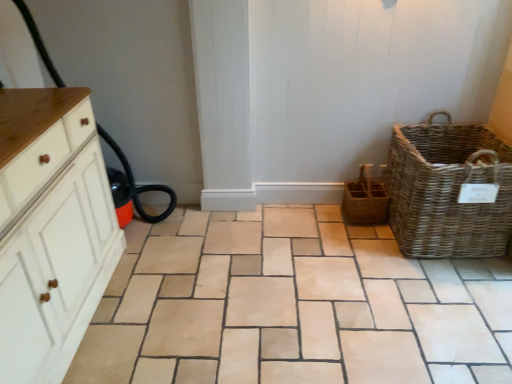
Describe the element at coordinates (51, 230) in the screenshot. The height and width of the screenshot is (384, 512). I see `white wood cabinet at left` at that location.

The image size is (512, 384). Find the location of `brown woven basket at center-right`. brown woven basket at center-right is located at coordinates (365, 199).

Where is `white wood cabinet at left`? This screenshot has height=384, width=512. white wood cabinet at left is located at coordinates (51, 230).

Considering the sizes of objects brown woven basket at center-right and natural woven picnic basket at right in the image provided, who is thinner, brown woven basket at center-right or natural woven picnic basket at right?

brown woven basket at center-right.

Identify the location of basket on the left of natural woven picnic basket at right. The height and width of the screenshot is (384, 512). (365, 199).

From a real-world perspective, who is located lower, brown woven basket at center-right or natural woven picnic basket at right?

In real-world perspective, brown woven basket at center-right is lower.

Is natural stone tile at center inside or outside of natural woven picnic basket at right?

natural stone tile at center cannot be found inside natural woven picnic basket at right.

Which object is positioned more to the left, natural stone tile at center or natural woven picnic basket at right?

natural stone tile at center.

How far apart are natural stone tile at center and natural woven picnic basket at right?

They are 23.86 inches apart.

From a real-world perspective, is natural stone tile at center above or below natural woven picnic basket at right?

Clearly, from a real-world perspective, natural stone tile at center is below natural woven picnic basket at right.

Can you tell me how much natural woven picnic basket at right and brown woven basket at center-right differ in facing direction?

There is a 0.357-degree angle between the facing directions of natural woven picnic basket at right and brown woven basket at center-right.

Is natural woven picnic basket at right not close to brown woven basket at center-right?

natural woven picnic basket at right is near brown woven basket at center-right, not far away.

Where is `picnic basket above the brown woven basket at center-right (from the image's perspective)`? picnic basket above the brown woven basket at center-right (from the image's perspective) is located at coordinates (448, 190).

The image size is (512, 384). Identify the location of picnic basket on the right of white wood cabinet at left. (448, 190).

Is natural woven picnic basket at right next to white wood cabinet at left?

No, natural woven picnic basket at right is not with white wood cabinet at left.

How different are the orientations of natural woven picnic basket at right and white wood cabinet at left in degrees?

natural woven picnic basket at right and white wood cabinet at left are facing 86.3 degrees away from each other.

From a real-world perspective, which is physically above, natural woven picnic basket at right or white wood cabinet at left?

white wood cabinet at left, from a real-world perspective.

Which of these two, natural stone tile at center or brown woven basket at center-right, stands shorter?

Standing shorter between the two is natural stone tile at center.

Based on the photo, can we say natural stone tile at center lies outside brown woven basket at center-right?

Yes, natural stone tile at center is not within brown woven basket at center-right.

The height and width of the screenshot is (384, 512). Identify the location of ceramic tile lying on the left of brown woven basket at center-right. (293, 306).

From a real-world perspective, is natural stone tile at center on top of brown woven basket at center-right?

No.

Relative to natural stone tile at center, is white wood cabinet at left in front or behind?

Clearly, white wood cabinet at left is in front of natural stone tile at center.

Would you say white wood cabinet at left is inside or outside natural stone tile at center?

white wood cabinet at left cannot be found inside natural stone tile at center.

Are white wood cabinet at left and natural stone tile at center located far from each other?

Actually, white wood cabinet at left and natural stone tile at center are a little close together.

From a real-world perspective, which is physically above, white wood cabinet at left or natural stone tile at center?

white wood cabinet at left is physically above.

In the scene shown: How distant is white wood cabinet at left from natural woven picnic basket at right?

1.74 meters.

Does white wood cabinet at left have a smaller size compared to natural woven picnic basket at right?

Actually, white wood cabinet at left might be larger than natural woven picnic basket at right.

I want to click on picnic basket above the white wood cabinet at left (from the image's perspective), so pyautogui.click(x=448, y=190).

Is white wood cabinet at left aimed at natural woven picnic basket at right?

Yes, white wood cabinet at left is facing natural woven picnic basket at right.

Identify the location of picnic basket above the brown woven basket at center-right (from the image's perspective). (448, 190).

Locate an element on the screen. ceramic tile to the left of natural woven picnic basket at right is located at coordinates (293, 306).

When comparing their distances from natural woven picnic basket at right, does brown woven basket at center-right or white wood cabinet at left seem closer?

The object closer to natural woven picnic basket at right is brown woven basket at center-right.

Considering their positions, is natural stone tile at center positioned closer to natural woven picnic basket at right than brown woven basket at center-right?

brown woven basket at center-right is positioned closer to the anchor natural woven picnic basket at right.

Considering their positions, is white wood cabinet at left positioned closer to natural stone tile at center than brown woven basket at center-right?

The object closer to natural stone tile at center is brown woven basket at center-right.

Which object lies further to the anchor point natural woven picnic basket at right, white wood cabinet at left or brown woven basket at center-right?

white wood cabinet at left.

Looking at the image, which one is located further to natural stone tile at center, brown woven basket at center-right or natural woven picnic basket at right?

brown woven basket at center-right.

Which object lies nearer to the anchor point white wood cabinet at left, natural stone tile at center or natural woven picnic basket at right?

natural stone tile at center.

Which object lies further to the anchor point brown woven basket at center-right, natural stone tile at center or natural woven picnic basket at right?

natural stone tile at center is positioned further to the anchor brown woven basket at center-right.

Looking at the image, which one is located further to natural stone tile at center, brown woven basket at center-right or white wood cabinet at left?

white wood cabinet at left is positioned further to the anchor natural stone tile at center.

Where is `ceramic tile located between white wood cabinet at left and brown woven basket at center-right in the left-right direction`? ceramic tile located between white wood cabinet at left and brown woven basket at center-right in the left-right direction is located at coordinates (293, 306).

Find the location of a particular element. Image resolution: width=512 pixels, height=384 pixels. basket situated between white wood cabinet at left and natural woven picnic basket at right from left to right is located at coordinates (365, 199).

The height and width of the screenshot is (384, 512). I want to click on ceramic tile situated between white wood cabinet at left and natural woven picnic basket at right from left to right, so click(x=293, y=306).

Where is `picnic basket between natural stone tile at center and brown woven basket at center-right from front to back`? This screenshot has width=512, height=384. picnic basket between natural stone tile at center and brown woven basket at center-right from front to back is located at coordinates 448,190.